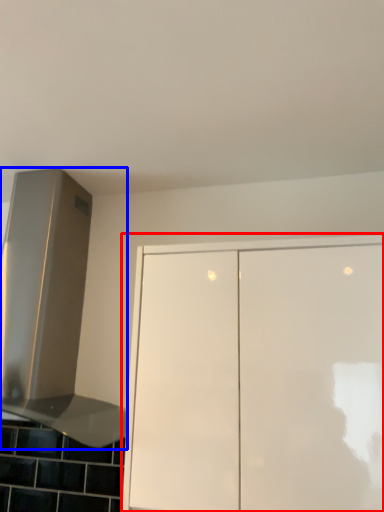
Question: Which point is closer to the camera, cabinetry (highlighted by a red box) or vent (highlighted by a blue box)?

Choices:
 (A) cabinetry
 (B) vent

Answer: (A)